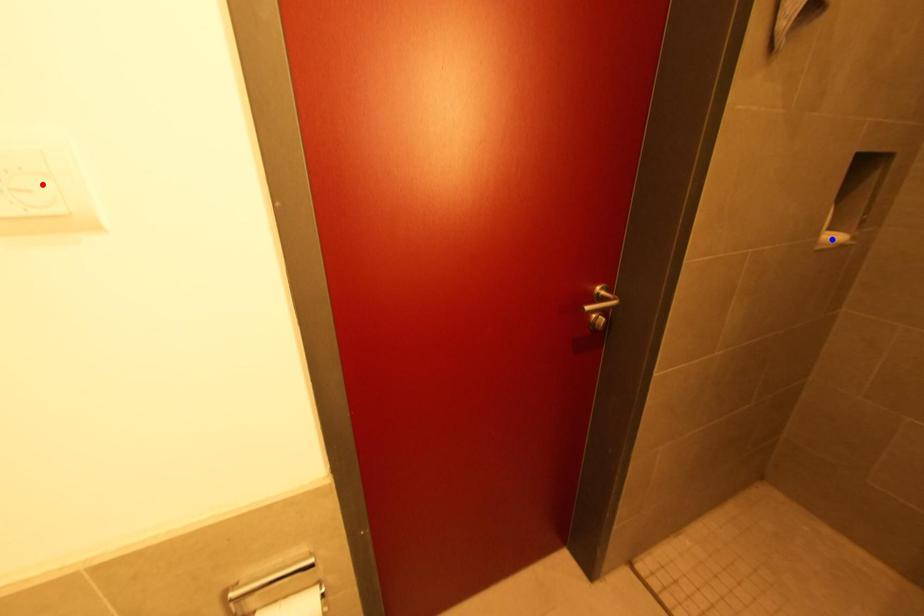
Question: Two points are marked on the image. Which point is closer to the camera?

Choices:
 (A) Blue point is closer.
 (B) Red point is closer.

Answer: (B)